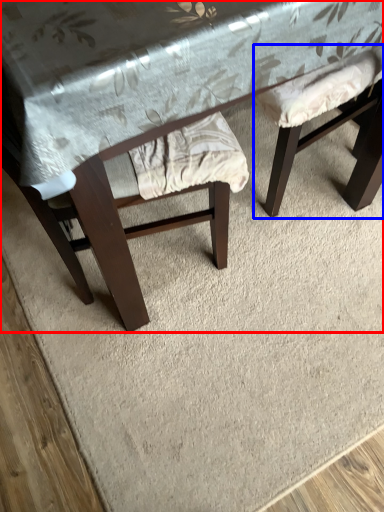
Question: Among these objects, which one is farthest to the camera, table (highlighted by a red box) or swivel chair (highlighted by a blue box)?

Choices:
 (A) table
 (B) swivel chair

Answer: (B)